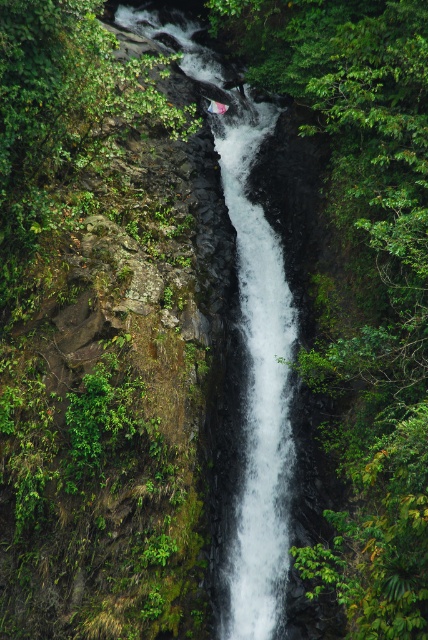
You are standing at the base of the waterfall and want to locate two specific points marked in the image. The first point is at coordinates point (278,561), and the second is at point (252,384). From your vantage point, which point appears closer to you?

Point (278,561) is in front of point (252,384), so it appears closer to you.

You are a photographer aiming to capture the waterfall and its surroundings. You notice the white smooth waterfall at center and the white frothy water at center. Which one is closer to the camera lens?

The white frothy water at center is closer to the camera lens because the white smooth waterfall at center is positioned behind it.